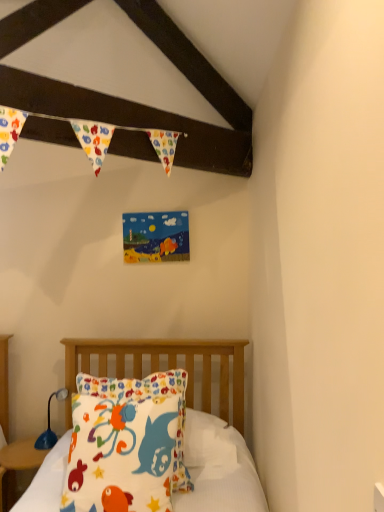
Identify the location of free space to the left of blue plastic lamp at lower left. This screenshot has height=512, width=384. (20, 448).